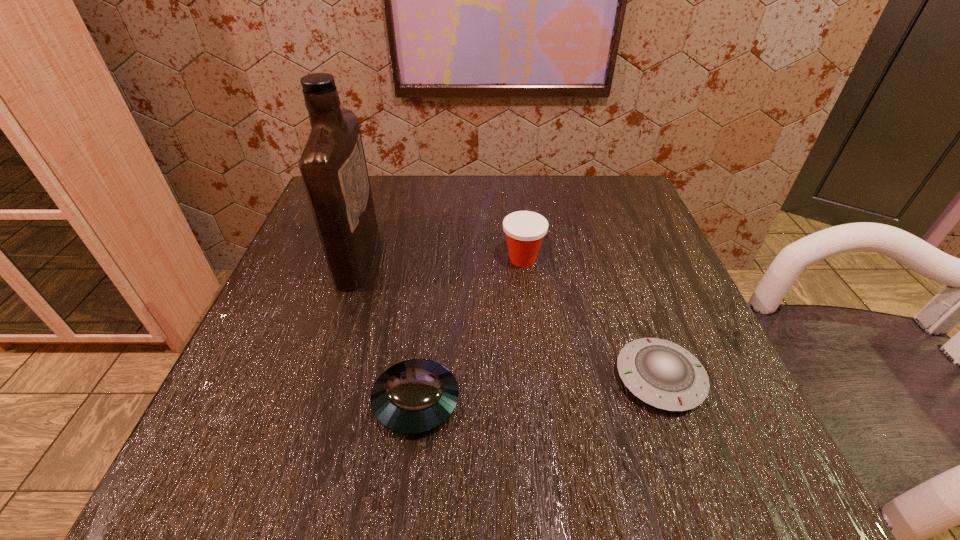
Where is `free space located on the left of the second shortest object`? This screenshot has width=960, height=540. free space located on the left of the second shortest object is located at coordinates (324, 401).

At what (x,y) coordinates should I click in order to perform the action: click on free location located 0.260m on the back of the shorter saucer. Please return your answer as a coordinate pair (x, y). This screenshot has width=960, height=540. Looking at the image, I should click on tap(612, 245).

Identify the location of object present at the far edge. (333, 167).

This screenshot has height=540, width=960. In order to click on object that is at the near edge in this screenshot , I will do `click(415, 396)`.

The height and width of the screenshot is (540, 960). I want to click on object that is at the left edge, so click(333, 167).

Identify the location of object situated at the right edge. (663, 374).

Locate an element on the screen. This screenshot has height=540, width=960. object present at the far left corner is located at coordinates (333, 167).

You are a GUI agent. You are given a task and a screenshot of the screen. Output one action in this format:
    pyautogui.click(x=<x>, y=<y>)
    Task: Click on the vacant position at the far edge of the desktop
    The image size is (960, 540).
    Given the screenshot: What is the action you would take?
    pyautogui.click(x=493, y=191)

In the image, there is a desktop. Where is `vacant space at the near edge`? vacant space at the near edge is located at coordinates (316, 491).

Where is `free region at the left edge of the desktop`? This screenshot has width=960, height=540. free region at the left edge of the desktop is located at coordinates (254, 342).